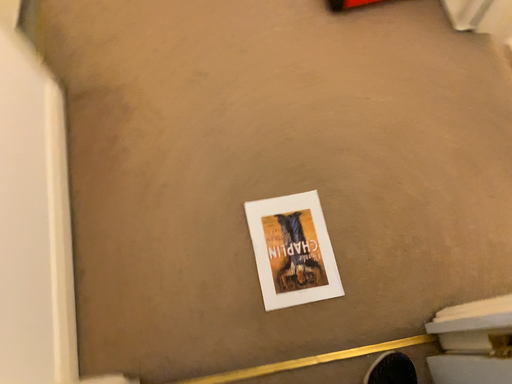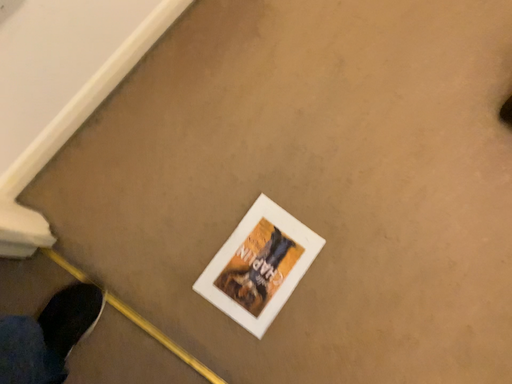
Question: Which way did the camera rotate in the video?

Choices:
 (A) rotated left
 (B) rotated right

Answer: (A)